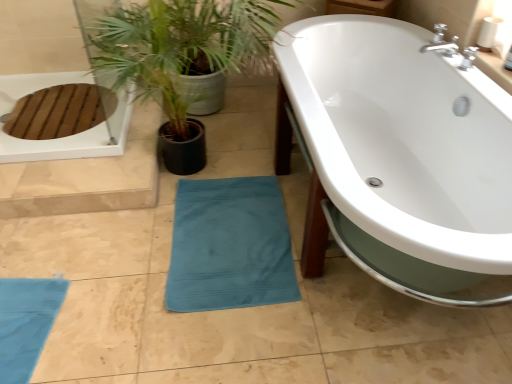
Question: From the image's perspective, is teal fabric plant at lower center located above or below teal cotton beach towel at lower center?

Choices:
 (A) below
 (B) above

Answer: (B)

Question: From a real-world perspective, is teal fabric plant at lower center physically located above or below teal cotton beach towel at lower center?

Choices:
 (A) above
 (B) below

Answer: (A)

Question: Considering the real-world distances, which object is farthest from the white glossy bathtub at center?

Choices:
 (A) teal fabric plant at lower center
 (B) teal cotton beach towel at lower center

Answer: (A)

Question: Which object is positioned closest to the teal fabric plant at lower center?

Choices:
 (A) white glossy bathtub at center
 (B) teal cotton beach towel at lower center

Answer: (A)